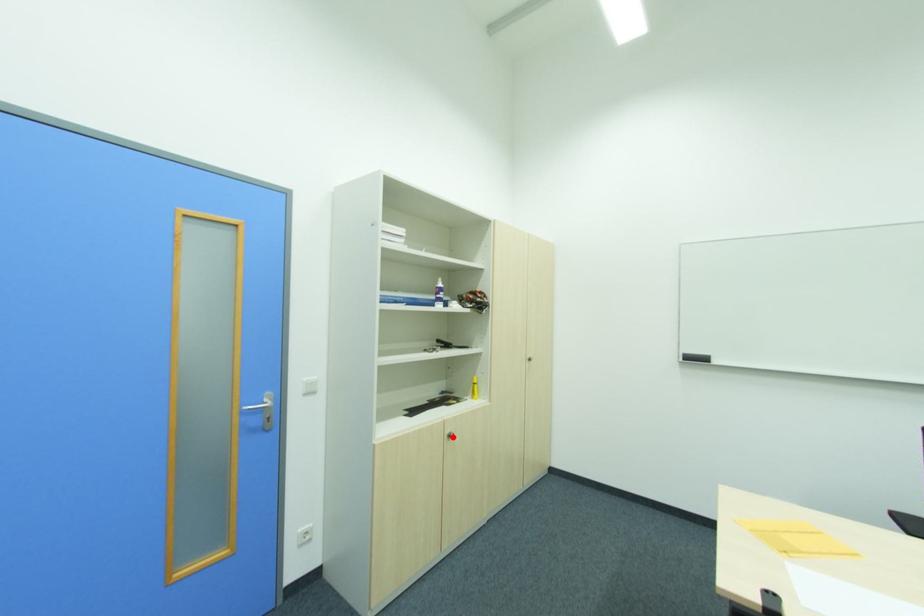
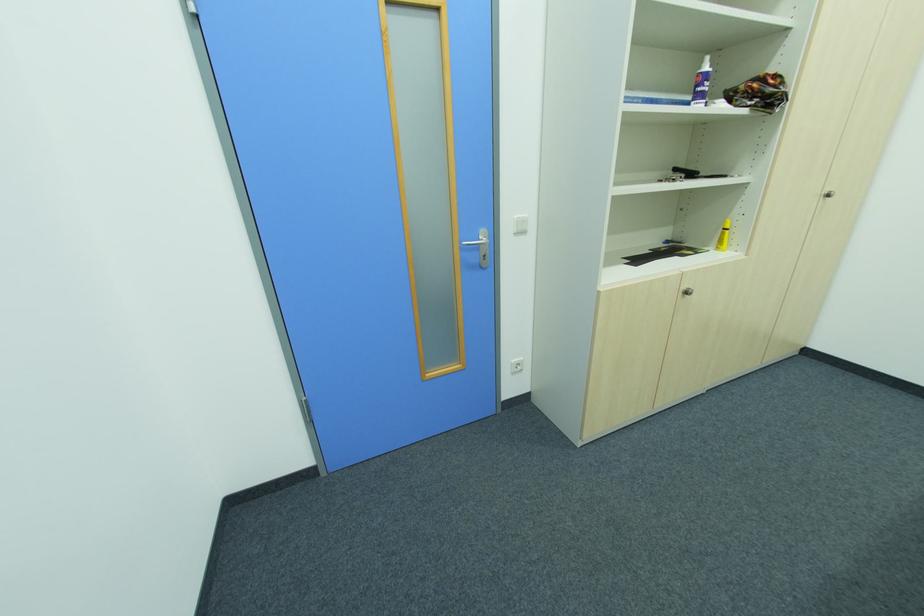
Question: I am providing you with two images of the same scene from different viewpoints. Image1 has a red point marked. In image2, the corresponding 3D location appears at what relative position? Reply with the corresponding letter.

Choices:
 (A) Closer
 (B) Farther

Answer: (A)